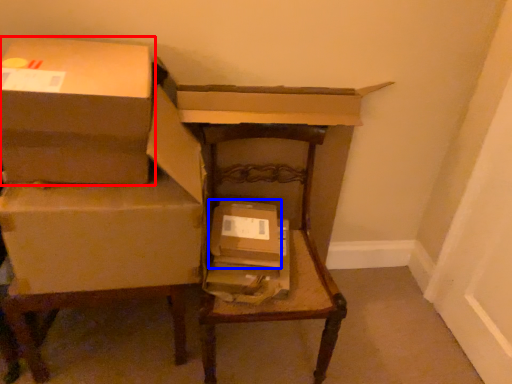
Question: Which of the following is the closest to the observer, box (highlighted by a red box) or box (highlighted by a blue box)?

Choices:
 (A) box
 (B) box

Answer: (A)